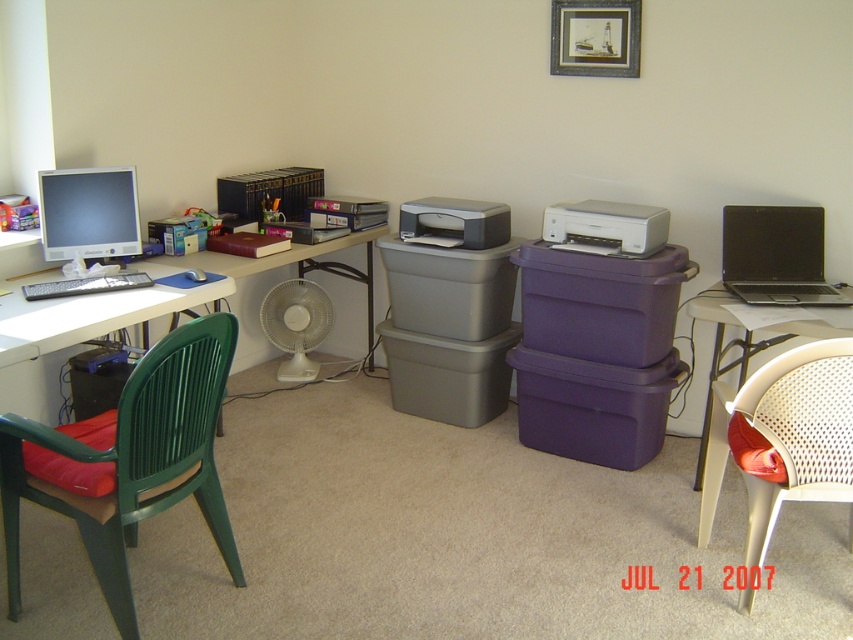
You are organizing the office and need to place a new large document tray. Which printer, the white plastic printer at center right or the matte gray printer at center, has more space around it to accommodate the tray?

The white plastic printer at center right is larger in size than the matte gray printer at center, so it likely has more space around it to accommodate the new large document tray.